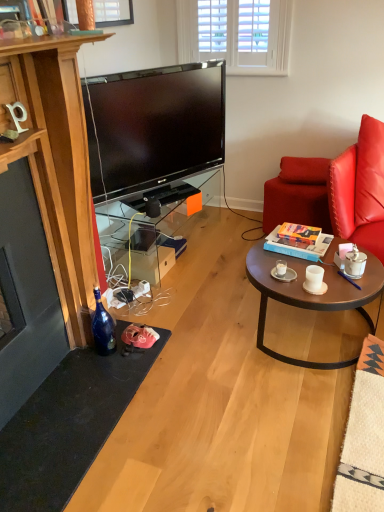
Question: Does white matte coffee cup at center right, which ranks as the 2th coffee cup in left-to-right order, come in front of white ceramic coffee cup at right, the third coffee cup positioned from the left?

Choices:
 (A) no
 (B) yes

Answer: (B)

Question: From a real-world perspective, is white matte coffee cup at center right, placed as the 2th coffee cup when sorted from right to left, on white ceramic coffee cup at right, the third coffee cup positioned from the left?

Choices:
 (A) yes
 (B) no

Answer: (B)

Question: Considering the relative sizes of white matte coffee cup at center right, which ranks as the 2th coffee cup in left-to-right order, and white ceramic coffee cup at right, the third coffee cup positioned from the left, in the image provided, is white matte coffee cup at center right, which ranks as the 2th coffee cup in left-to-right order, taller than white ceramic coffee cup at right, the third coffee cup positioned from the left,?

Choices:
 (A) yes
 (B) no

Answer: (B)

Question: Is white matte coffee cup at center right, placed as the 2th coffee cup when sorted from right to left, in contact with white ceramic coffee cup at right, the third coffee cup positioned from the left?

Choices:
 (A) yes
 (B) no

Answer: (B)

Question: Is white matte coffee cup at center right, placed as the 2th coffee cup when sorted from right to left, located outside white ceramic coffee cup at right, which is the first coffee cup in right-to-left order?

Choices:
 (A) no
 (B) yes

Answer: (B)

Question: Does white matte coffee cup at center right, which ranks as the 2th coffee cup in left-to-right order, appear on the left side of white ceramic coffee cup at right, which is the first coffee cup in right-to-left order?

Choices:
 (A) no
 (B) yes

Answer: (B)

Question: From a real-world perspective, is purple plastic pen at coffee table under transparent glass tv stand at center?

Choices:
 (A) yes
 (B) no

Answer: (B)

Question: Is purple plastic pen at coffee table wider than transparent glass tv stand at center?

Choices:
 (A) no
 (B) yes

Answer: (A)

Question: Does purple plastic pen at coffee table lie in front of transparent glass tv stand at center?

Choices:
 (A) no
 (B) yes

Answer: (B)

Question: Does purple plastic pen at coffee table have a lesser width compared to transparent glass tv stand at center?

Choices:
 (A) yes
 (B) no

Answer: (A)

Question: Does purple plastic pen at coffee table have a lesser height compared to transparent glass tv stand at center?

Choices:
 (A) no
 (B) yes

Answer: (B)

Question: Is purple plastic pen at coffee table with transparent glass tv stand at center?

Choices:
 (A) no
 (B) yes

Answer: (A)

Question: Is hardcover book at center smaller than leather cushion at right?

Choices:
 (A) no
 (B) yes

Answer: (B)